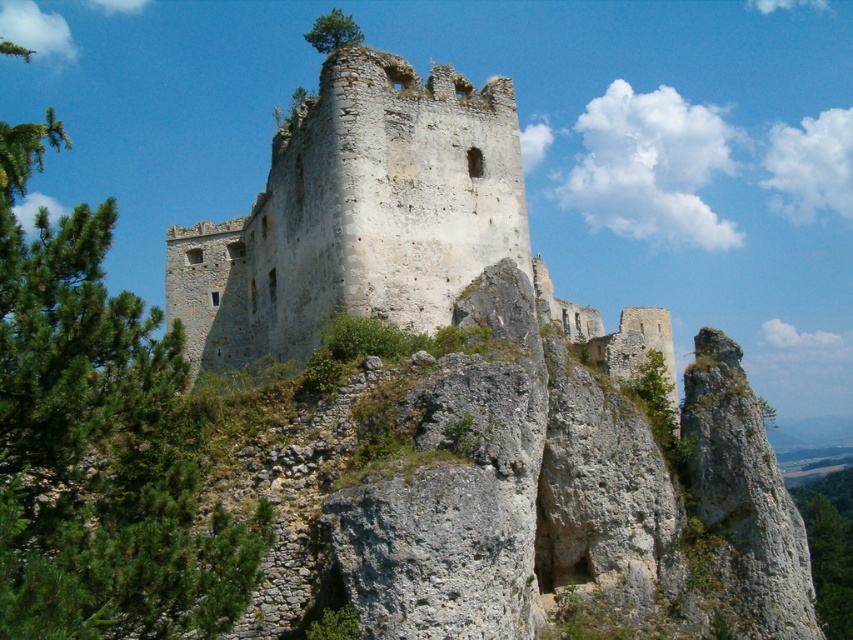
Is weathered stone castle at center below green leafy tree at upper center?

Correct, weathered stone castle at center is located below green leafy tree at upper center.

Which is below, weathered stone castle at center or green leafy tree at upper center?

Positioned lower is weathered stone castle at center.

This screenshot has width=853, height=640. I want to click on weathered stone castle at center, so click(378, 224).

Is green leafy tree at left thinner than green leafy tree at upper center?

In fact, green leafy tree at left might be wider than green leafy tree at upper center.

Who is positioned more to the right, green leafy tree at left or green leafy tree at upper center?

green leafy tree at upper center

Does point (85, 380) come farther from viewer compared to point (306, 38)?

No, it is in front of (306, 38).

Locate an element on the screen. The image size is (853, 640). green leafy tree at left is located at coordinates (97, 442).

Between green leafy tree at left and weathered stone castle at center, which one appears on the left side from the viewer's perspective?

green leafy tree at left

Is point (120, 627) positioned after point (339, 170)?

That is False.

Does point (67, 499) lie behind point (485, 88)?

No, it is not.

This screenshot has width=853, height=640. Identify the location of green leafy tree at left. (97, 442).